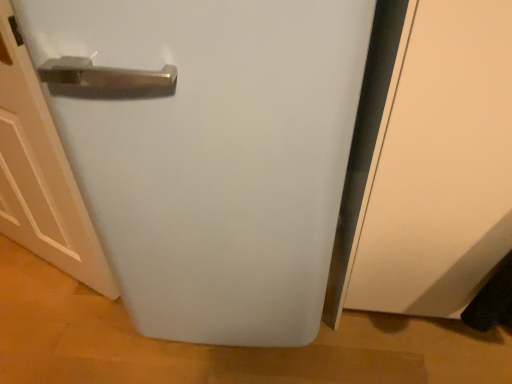
What do you see at coordinates (212, 154) in the screenshot?
I see `white matte refrigerator at center` at bounding box center [212, 154].

Where is `white matte refrigerator at center`? The width and height of the screenshot is (512, 384). white matte refrigerator at center is located at coordinates (212, 154).

What do you see at coordinates (41, 173) in the screenshot?
I see `white matte door at left` at bounding box center [41, 173].

The width and height of the screenshot is (512, 384). I want to click on white matte door at left, so click(x=41, y=173).

Where is `white matte refrigerator at center`? white matte refrigerator at center is located at coordinates pos(212,154).

Considering the relative positions of white matte refrigerator at center and white matte door at left in the image provided, is white matte refrigerator at center to the left of white matte door at left from the viewer's perspective?

In fact, white matte refrigerator at center is to the right of white matte door at left.

Which object is further away from the camera taking this photo, white matte refrigerator at center or white matte door at left?

white matte door at left is further away from the camera.

From the picture: Which point is more forward, (126, 243) or (4, 95)?

Positioned in front is point (126, 243).

From the image's perspective, between white matte refrigerator at center and white matte door at left, who is located below?

white matte door at left.

From a real-world perspective, is white matte refrigerator at center located higher than white matte door at left?

Correct, in the physical world, white matte refrigerator at center is higher than white matte door at left.

Consider the image. Does white matte refrigerator at center have a greater width compared to white matte door at left?

Yes.

Which of these two, white matte refrigerator at center or white matte door at left, stands shorter?

white matte door at left.

Looking at the image, does white matte refrigerator at center seem bigger or smaller compared to white matte door at left?

Clearly, white matte refrigerator at center is larger in size than white matte door at left.

Do you think white matte refrigerator at center is within white matte door at left, or outside of it?

white matte refrigerator at center is not inside white matte door at left, it's outside.

Is white matte refrigerator at center far away from white matte door at left?

They are positioned close to each other.

Does white matte refrigerator at center turn towards white matte door at left?

No, white matte refrigerator at center is not oriented towards white matte door at left.

Can you tell me how much white matte refrigerator at center and white matte door at left differ in facing direction?

The angle between the facing direction of white matte refrigerator at center and the facing direction of white matte door at left is 36.1 degrees.

You are a GUI agent. You are given a task and a screenshot of the screen. Output one action in this format:
    pyautogui.click(x=<x>, y=<y>)
    Task: Click on the refrigerator above the white matte door at left (from a real-world perspective)
    This screenshot has height=384, width=512.
    Given the screenshot: What is the action you would take?
    pyautogui.click(x=212, y=154)

Based on their positions, is white matte door at left located to the left or right of white matte refrigerator at center?

white matte door at left is positioned on white matte refrigerator at center's left side.

Is white matte door at left positioned in front of white matte refrigerator at center?

No.

Is point (51, 206) more distant than point (187, 23)?

Yes.

From the image's perspective, is white matte door at left located above or below white matte refrigerator at center?

Based on their image positions, white matte door at left is located beneath white matte refrigerator at center.

From a real-world perspective, is white matte door at left under white matte refrigerator at center?

Indeed, from a real-world perspective, white matte door at left is positioned beneath white matte refrigerator at center.

Which of these two, white matte door at left or white matte refrigerator at center, is thinner?

white matte door at left is thinner.

Does white matte door at left have a lesser height compared to white matte refrigerator at center?

Yes, white matte door at left is shorter than white matte refrigerator at center.

Is white matte door at left bigger or smaller than white matte refrigerator at center?

In the image, white matte door at left appears to be smaller than white matte refrigerator at center.

Is white matte refrigerator at center completely or partially inside white matte door at left?

No, white matte door at left does not contain white matte refrigerator at center.

Are white matte door at left and white matte refrigerator at center far apart?

No.

Is white matte refrigerator at center at the back of white matte door at left?

That's not correct — white matte door at left is not looking away from white matte refrigerator at center.

How far apart are white matte door at left and white matte refrigerator at center?

white matte door at left is 15.90 inches from white matte refrigerator at center.

In the image, there is a white matte refrigerator at center. Where is `door below it (from the image's perspective)`? Image resolution: width=512 pixels, height=384 pixels. door below it (from the image's perspective) is located at coordinates (41, 173).

At what (x,y) coordinates should I click in order to perform the action: click on door behind the white matte refrigerator at center. Please return your answer as a coordinate pair (x, y). Image resolution: width=512 pixels, height=384 pixels. Looking at the image, I should click on (41, 173).

I want to click on door that is under the white matte refrigerator at center (from a real-world perspective), so click(x=41, y=173).